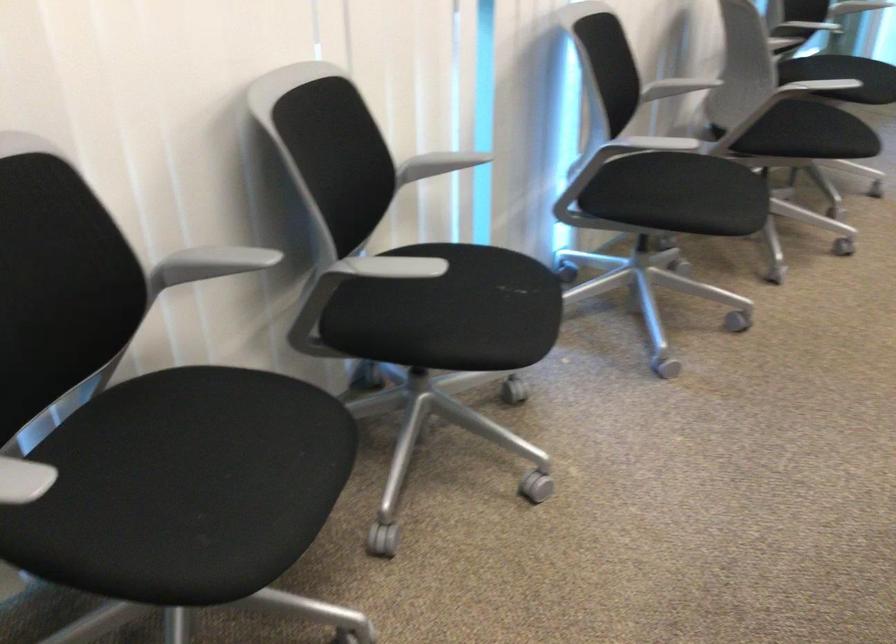
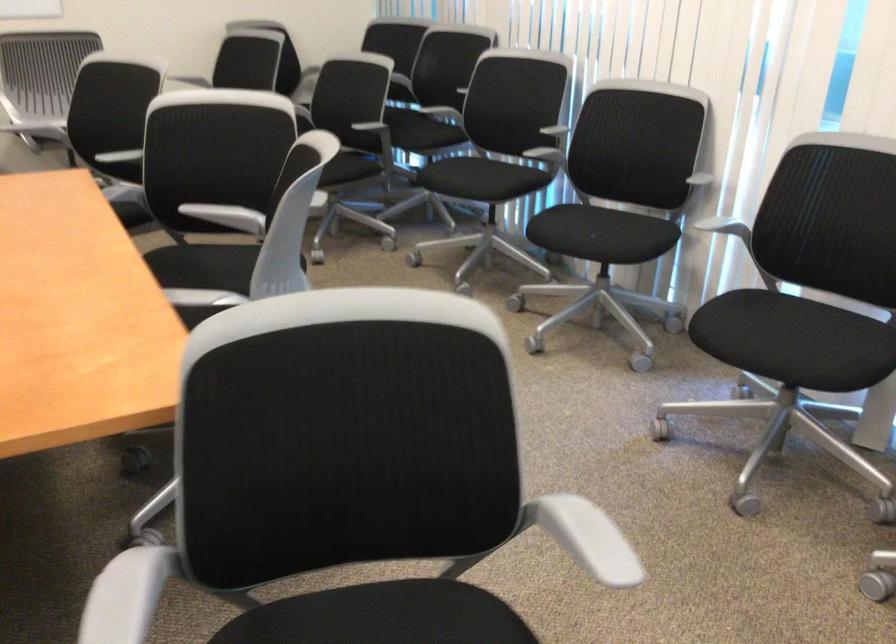
Find the pixel in the second image that matches (259,444) in the first image.

(480, 178)